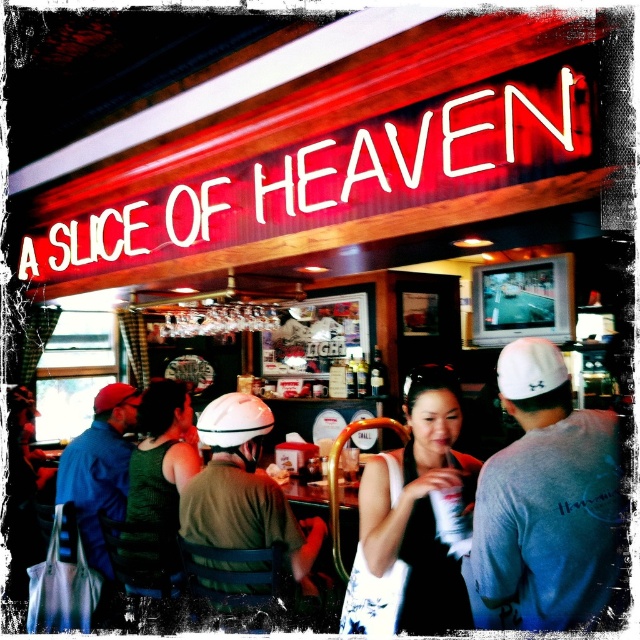
Can you confirm if black fabric dress at center is smaller than matte green helmet at center?

Correct, black fabric dress at center occupies less space than matte green helmet at center.

Can you confirm if black fabric dress at center is thinner than matte green helmet at center?

Indeed, black fabric dress at center has a lesser width compared to matte green helmet at center.

Where is `black fabric dress at center`? The height and width of the screenshot is (640, 640). black fabric dress at center is located at coordinates (412, 520).

Can you confirm if black fabric dress at center is taller than white matte baseball hat at center?

Correct, black fabric dress at center is much taller as white matte baseball hat at center.

Which of these two, black fabric dress at center or white matte baseball hat at center, stands shorter?

Standing shorter between the two is white matte baseball hat at center.

The image size is (640, 640). Describe the element at coordinates (412, 520) in the screenshot. I see `black fabric dress at center` at that location.

Find the location of a particular element. The width and height of the screenshot is (640, 640). black fabric dress at center is located at coordinates (412, 520).

From the picture: Measure the distance from green fabric tank top at center to white matte baseball hat at center.

27.92 inches

Can you confirm if green fabric tank top at center is thinner than white matte baseball hat at center?

Incorrect, green fabric tank top at center's width is not less than white matte baseball hat at center's.

Where is `green fabric tank top at center`? The image size is (640, 640). green fabric tank top at center is located at coordinates (160, 490).